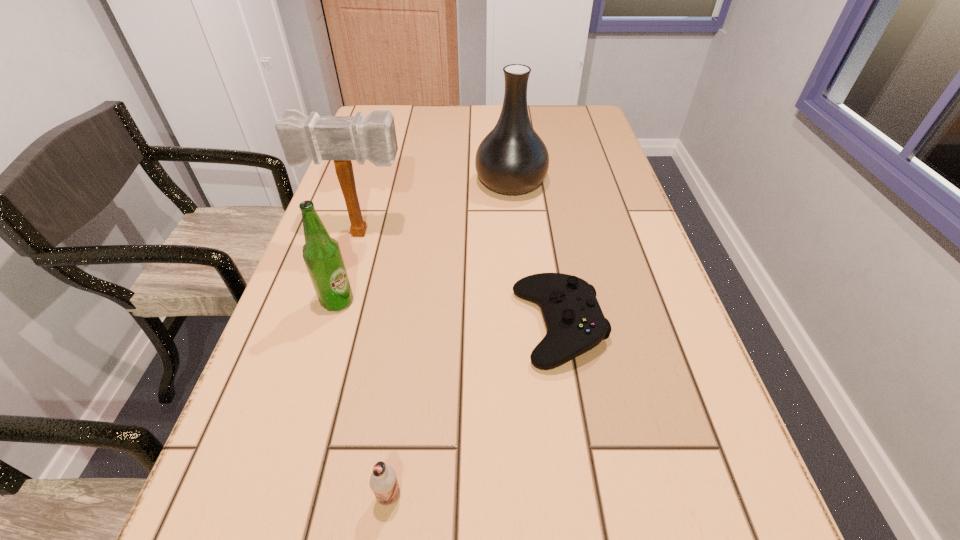
Find the location of a particular element. vacant space situated on the right of the control is located at coordinates (667, 326).

At what (x,y) coordinates should I click in order to perform the action: click on mallet located at the left edge. Please return your answer as a coordinate pair (x, y). This screenshot has width=960, height=540. Looking at the image, I should click on (340, 138).

Where is `beer bottle that is at the left edge`? This screenshot has width=960, height=540. beer bottle that is at the left edge is located at coordinates (321, 253).

The image size is (960, 540). Identify the location of object that is at the right edge. (575, 323).

Locate an element on the screen. vacant space at the far edge is located at coordinates (476, 111).

In the image, there is a desktop. At what (x,y) coordinates should I click in order to perform the action: click on vacant space at the left edge. Please return your answer as a coordinate pair (x, y). The height and width of the screenshot is (540, 960). Looking at the image, I should click on (210, 488).

This screenshot has height=540, width=960. Find the location of `free space at the right edge of the desktop`. free space at the right edge of the desktop is located at coordinates (589, 224).

You are a GUI agent. You are given a task and a screenshot of the screen. Output one action in this format:
    pyautogui.click(x=<x>, y=<y>)
    Task: Click on the vacant space at the far right corner
    
    Given the screenshot: What is the action you would take?
    pyautogui.click(x=557, y=122)

This screenshot has width=960, height=540. Find the location of `empty location between the shortest object and the beer bottle`. empty location between the shortest object and the beer bottle is located at coordinates [x=448, y=314].

You are a GUI agent. You are given a task and a screenshot of the screen. Output one action in this format:
    pyautogui.click(x=<x>, y=<y>)
    Task: Click on the vacant point located between the chocolate milk and the third shortest object
    The width and height of the screenshot is (960, 540).
    Given the screenshot: What is the action you would take?
    pyautogui.click(x=364, y=399)